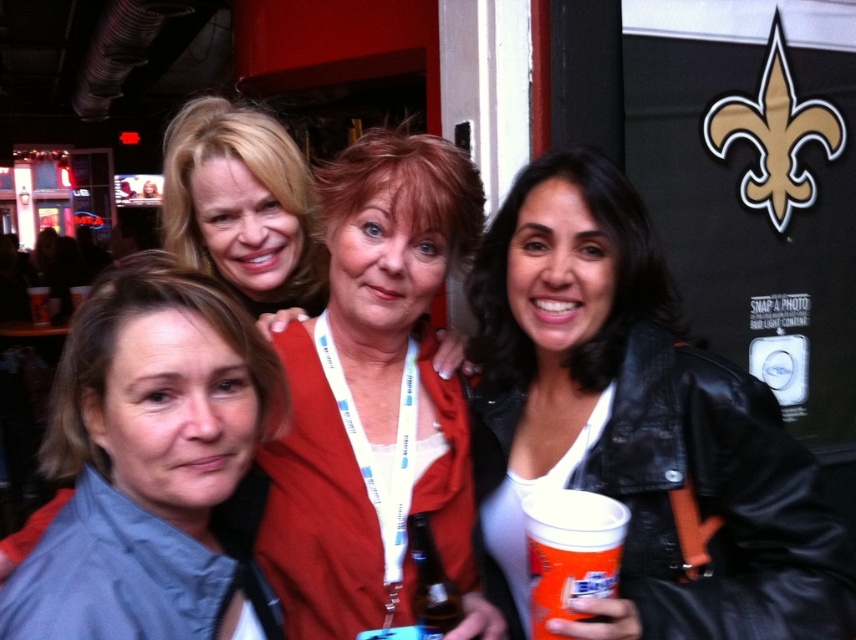
Question: Does matte black jacket at center appear over matte blonde hair at upper left?

Choices:
 (A) yes
 (B) no

Answer: (B)

Question: Based on their relative distances, which object is farther from the gray fabric jacket at lower left?

Choices:
 (A) matte blonde hair at upper left
 (B) black leather jacket at center

Answer: (A)

Question: Is black leather jacket at center positioned behind matte black jacket at center?

Choices:
 (A) no
 (B) yes

Answer: (A)

Question: Among these objects, which one is farthest from the camera?

Choices:
 (A) matte blonde hair at upper left
 (B) matte black jacket at center
 (C) gray fabric jacket at lower left

Answer: (A)

Question: Estimate the real-world distances between objects in this image. Which object is farther from the black leather jacket at center?

Choices:
 (A) matte blonde hair at upper left
 (B) matte black jacket at center
 (C) gray fabric jacket at lower left

Answer: (A)

Question: Can you confirm if black leather jacket at center is positioned above matte black jacket at center?

Choices:
 (A) yes
 (B) no

Answer: (B)